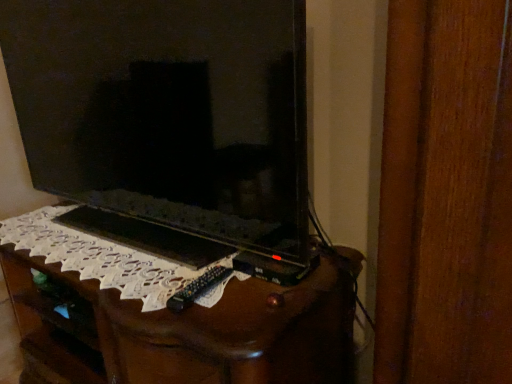
Question: Is the surface of matte black tv at center in direct contact with wooden tv stand at center?

Choices:
 (A) yes
 (B) no

Answer: (B)

Question: From the image's perspective, does matte black tv at center appear lower than wooden tv stand at center?

Choices:
 (A) no
 (B) yes

Answer: (A)

Question: Is matte black tv at center thinner than wooden tv stand at center?

Choices:
 (A) no
 (B) yes

Answer: (B)

Question: Is matte black tv at center oriented towards wooden tv stand at center?

Choices:
 (A) no
 (B) yes

Answer: (A)

Question: Is matte black tv at center in front of wooden tv stand at center?

Choices:
 (A) yes
 (B) no

Answer: (A)

Question: Does matte black tv at center have a smaller size compared to wooden tv stand at center?

Choices:
 (A) no
 (B) yes

Answer: (B)

Question: Could you tell me if wooden tv stand at center is turned towards matte black tv at center?

Choices:
 (A) no
 (B) yes

Answer: (A)

Question: Does wooden tv stand at center come in front of matte black tv at center?

Choices:
 (A) yes
 (B) no

Answer: (B)

Question: Is the position of wooden tv stand at center more distant than that of matte black tv at center?

Choices:
 (A) yes
 (B) no

Answer: (A)

Question: Is wooden tv stand at center located outside matte black tv at center?

Choices:
 (A) yes
 (B) no

Answer: (A)

Question: Would you say wooden tv stand at center is a long distance from matte black tv at center?

Choices:
 (A) no
 (B) yes

Answer: (A)

Question: From a real-world perspective, does wooden tv stand at center stand above matte black tv at center?

Choices:
 (A) yes
 (B) no

Answer: (B)

Question: In terms of height, does wooden tv stand at center look taller or shorter compared to matte black tv at center?

Choices:
 (A) short
 (B) tall

Answer: (A)